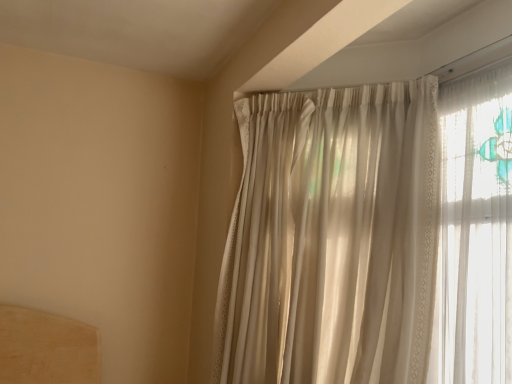
Describe the element at coordinates (333, 238) in the screenshot. The image size is (512, 384). I see `sheer white curtain at upper center` at that location.

What is the approximate height of sheer white curtain at upper center?

sheer white curtain at upper center is 1.29 meters in height.

The height and width of the screenshot is (384, 512). In order to click on sheer white curtain at upper center in this screenshot , I will do `click(333, 238)`.

The height and width of the screenshot is (384, 512). Find the location of `sheer white curtain at upper center`. sheer white curtain at upper center is located at coordinates (333, 238).